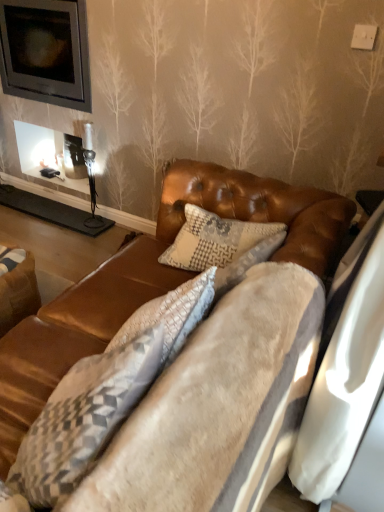
Question: Considering the relative positions of velvet brown couch at center and brown leather swivel chair at lower left in the image provided, is velvet brown couch at center to the left of brown leather swivel chair at lower left from the viewer's perspective?

Choices:
 (A) no
 (B) yes

Answer: (A)

Question: Is velvet brown couch at center looking in the opposite direction of brown leather swivel chair at lower left?

Choices:
 (A) yes
 (B) no

Answer: (B)

Question: From a real-world perspective, is velvet brown couch at center under brown leather swivel chair at lower left?

Choices:
 (A) yes
 (B) no

Answer: (B)

Question: Does velvet brown couch at center come behind brown leather swivel chair at lower left?

Choices:
 (A) no
 (B) yes

Answer: (A)

Question: Is velvet brown couch at center taller than brown leather swivel chair at lower left?

Choices:
 (A) yes
 (B) no

Answer: (B)

Question: Is velvet brown couch at center next to brown leather swivel chair at lower left and touching it?

Choices:
 (A) no
 (B) yes

Answer: (A)

Question: Considering the relative sizes of textured gray pillow at center and brown leather swivel chair at lower left in the image provided, is textured gray pillow at center taller than brown leather swivel chair at lower left?

Choices:
 (A) yes
 (B) no

Answer: (A)

Question: Is textured gray pillow at center facing away from brown leather swivel chair at lower left?

Choices:
 (A) no
 (B) yes

Answer: (A)

Question: From a real-world perspective, is textured gray pillow at center under brown leather swivel chair at lower left?

Choices:
 (A) no
 (B) yes

Answer: (A)

Question: Does textured gray pillow at center appear on the left side of brown leather swivel chair at lower left?

Choices:
 (A) yes
 (B) no

Answer: (B)

Question: Is textured gray pillow at center far from brown leather swivel chair at lower left?

Choices:
 (A) yes
 (B) no

Answer: (B)

Question: Can you confirm if textured gray pillow at center is bigger than brown leather swivel chair at lower left?

Choices:
 (A) no
 (B) yes

Answer: (B)

Question: Does velvet brown couch at center have a lesser width compared to textured gray pillow at center?

Choices:
 (A) no
 (B) yes

Answer: (B)